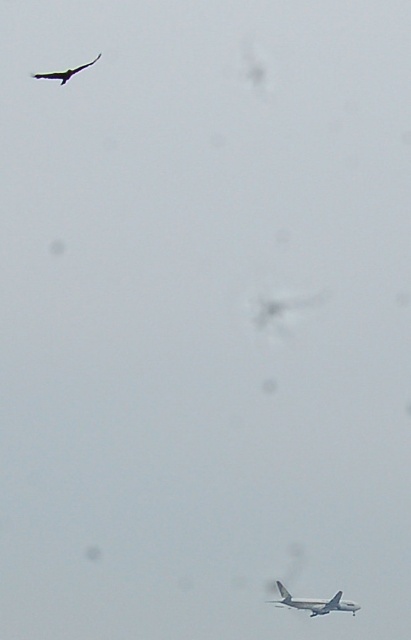
Question: Does silver metallic airplane at lower center have a greater width compared to dark gray feathers at upper left?

Choices:
 (A) yes
 (B) no

Answer: (A)

Question: Is silver metallic airplane at lower center thinner than dark gray feathers at upper left?

Choices:
 (A) yes
 (B) no

Answer: (B)

Question: Among these objects, which one is nearest to the camera?

Choices:
 (A) silver metallic airplane at lower center
 (B) dark gray feathers at upper left

Answer: (B)

Question: Among these points, which one is farthest from the camera?

Choices:
 (A) (69, 68)
 (B) (316, 598)

Answer: (A)

Question: Is silver metallic airplane at lower center to the left of dark gray feathers at upper left from the viewer's perspective?

Choices:
 (A) yes
 (B) no

Answer: (B)